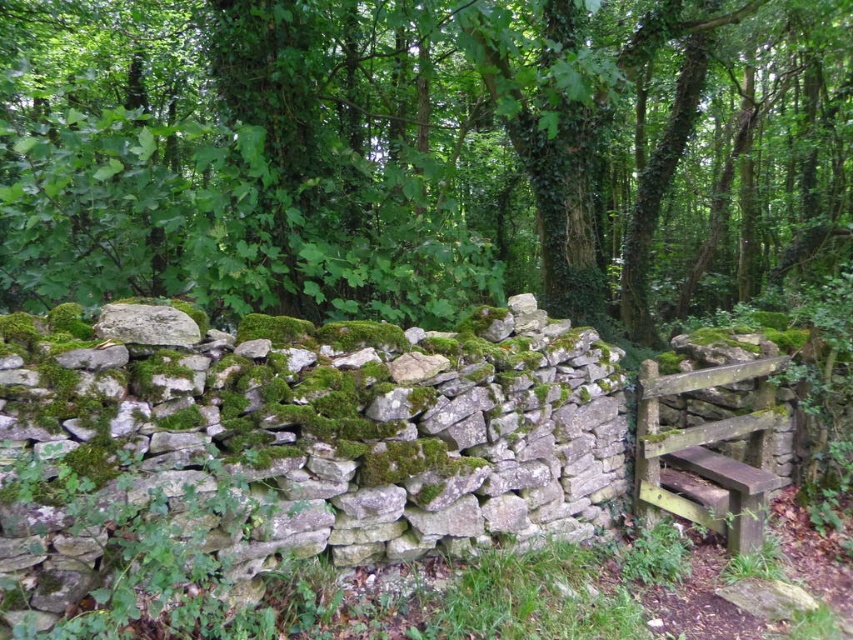
You are a hiker who wants to take a photo of the wooden gate at right. To get a clear shot, you need to ensure that the green mossy rock at upper left doesn

The green mossy rock at upper left is larger than the wooden gate at right, so it might block the view of the wooden gate at right if positioned in front. Move to a position where the rock is not between you and the gate.

You are a hiker who wants to place a 10 feet long wooden ladder between the green mossy rock at upper left and the gray stone wall at center. Can you fit the ladder horizontally between them?

The distance between the green mossy rock at upper left and the gray stone wall at center is 11.58 feet, so the 10 feet long wooden ladder can fit horizontally between them since it is shorter than the available space.

You are standing at the entrance of the forest and see the green mossy rock at upper left. Based on its coordinates, can you determine its position relative to the center of the image?

The green mossy rock at upper left is located at point 0.241 on the x axis and 0.497 on the y axis, so it is positioned to the left and near the center vertically compared to the image center.